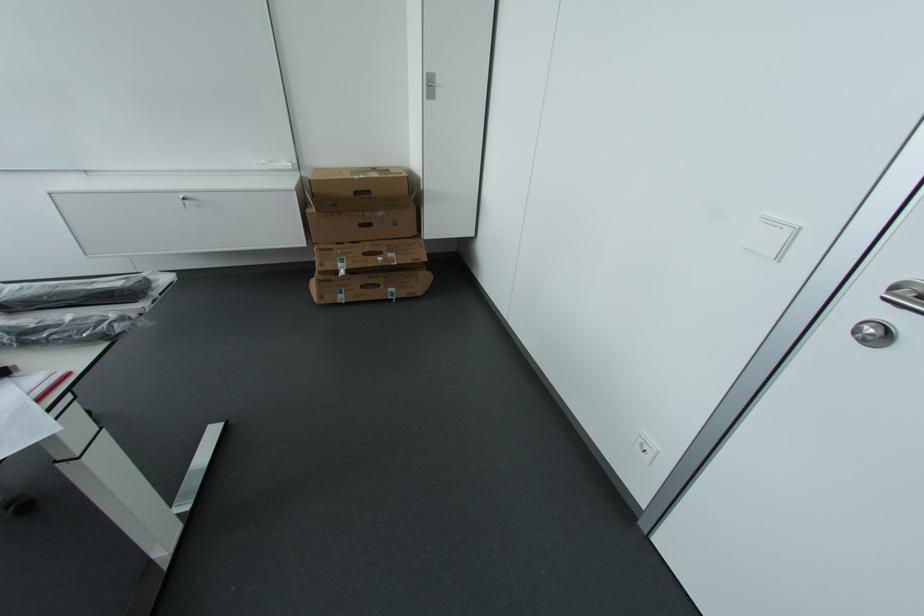
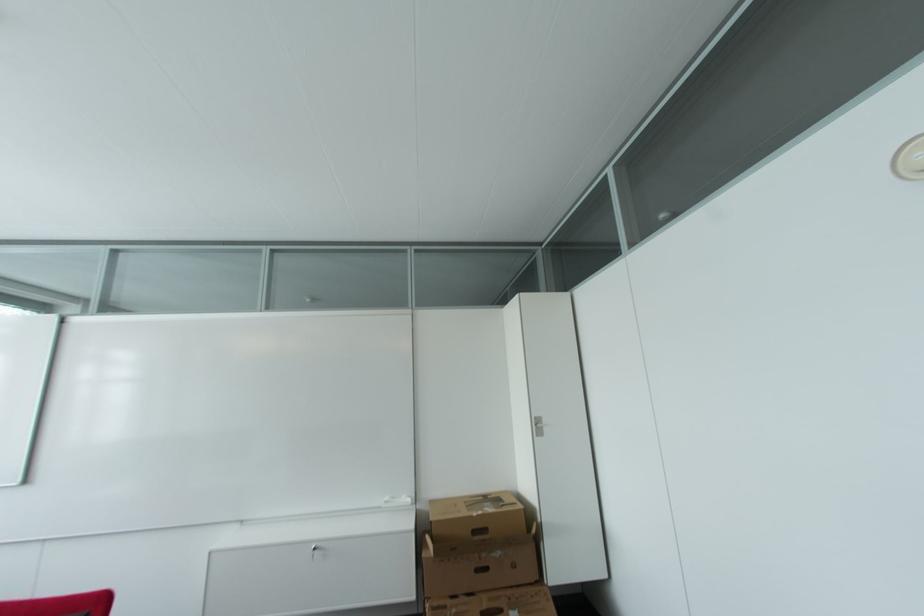
Question: Based on the continuous images, in which direction is the camera rotating? Reply with the corresponding letter.

Choices:
 (A) Left
 (B) Right
 (C) Up
 (D) Down

Answer: (C)